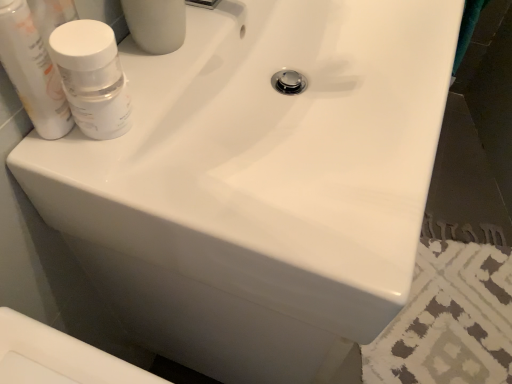
Question: Considering the relative positions of white glossy bottle at upper left, the 2th mouthwash from the right, and white matte bottle at upper left, acting as the second mouthwash starting from the left, in the image provided, is white glossy bottle at upper left, the 2th mouthwash from the right, to the left of white matte bottle at upper left, acting as the second mouthwash starting from the left, from the viewer's perspective?

Choices:
 (A) yes
 (B) no

Answer: (A)

Question: Is white glossy bottle at upper left, the 2th mouthwash from the right, oriented away from white matte bottle at upper left, which is counted as the 1th mouthwash, starting from the right?

Choices:
 (A) yes
 (B) no

Answer: (B)

Question: Is white glossy bottle at upper left, acting as the 1th mouthwash starting from the left, wider than white matte bottle at upper left, acting as the second mouthwash starting from the left?

Choices:
 (A) no
 (B) yes

Answer: (A)

Question: Is white glossy bottle at upper left, acting as the 1th mouthwash starting from the left, oriented towards white matte bottle at upper left, acting as the second mouthwash starting from the left?

Choices:
 (A) no
 (B) yes

Answer: (B)

Question: Is white glossy bottle at upper left, acting as the 1th mouthwash starting from the left, at the right side of white matte bottle at upper left, acting as the second mouthwash starting from the left?

Choices:
 (A) no
 (B) yes

Answer: (A)

Question: Is white glossy bottle at upper left, acting as the 1th mouthwash starting from the left, thinner than white matte bottle at upper left, acting as the second mouthwash starting from the left?

Choices:
 (A) no
 (B) yes

Answer: (B)

Question: Can you confirm if white matte bottle at upper left, acting as the second mouthwash starting from the left, is taller than white glossy bottle at upper left, the 2th mouthwash from the right?

Choices:
 (A) yes
 (B) no

Answer: (B)

Question: Is white glossy bottle at upper left, acting as the 1th mouthwash starting from the left, a part of white matte bottle at upper left, which is counted as the 1th mouthwash, starting from the right?

Choices:
 (A) yes
 (B) no

Answer: (B)

Question: Is white matte bottle at upper left, acting as the second mouthwash starting from the left, bigger than white glossy bottle at upper left, the 2th mouthwash from the right?

Choices:
 (A) yes
 (B) no

Answer: (A)

Question: Is white matte bottle at upper left, acting as the second mouthwash starting from the left, further to camera compared to white glossy bottle at upper left, the 2th mouthwash from the right?

Choices:
 (A) no
 (B) yes

Answer: (B)

Question: Is white matte bottle at upper left, acting as the second mouthwash starting from the left, oriented towards white glossy bottle at upper left, the 2th mouthwash from the right?

Choices:
 (A) no
 (B) yes

Answer: (A)

Question: Considering the relative sizes of white matte bottle at upper left, acting as the second mouthwash starting from the left, and white glossy bottle at upper left, acting as the 1th mouthwash starting from the left, in the image provided, is white matte bottle at upper left, acting as the second mouthwash starting from the left, thinner than white glossy bottle at upper left, acting as the 1th mouthwash starting from the left,?

Choices:
 (A) yes
 (B) no

Answer: (B)

Question: Looking at their shapes, would you say white matte bottle at upper left, acting as the second mouthwash starting from the left, is wider or thinner than white glossy bottle at upper left, the 2th mouthwash from the right?

Choices:
 (A) wide
 (B) thin

Answer: (A)